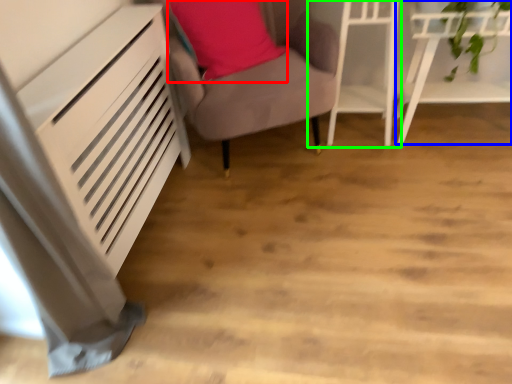
Question: Based on their relative distances, which object is nearer to pillow (highlighted by a red box)? Choose from furniture (highlighted by a blue box) and furniture (highlighted by a green box).

Choices:
 (A) furniture
 (B) furniture

Answer: (B)